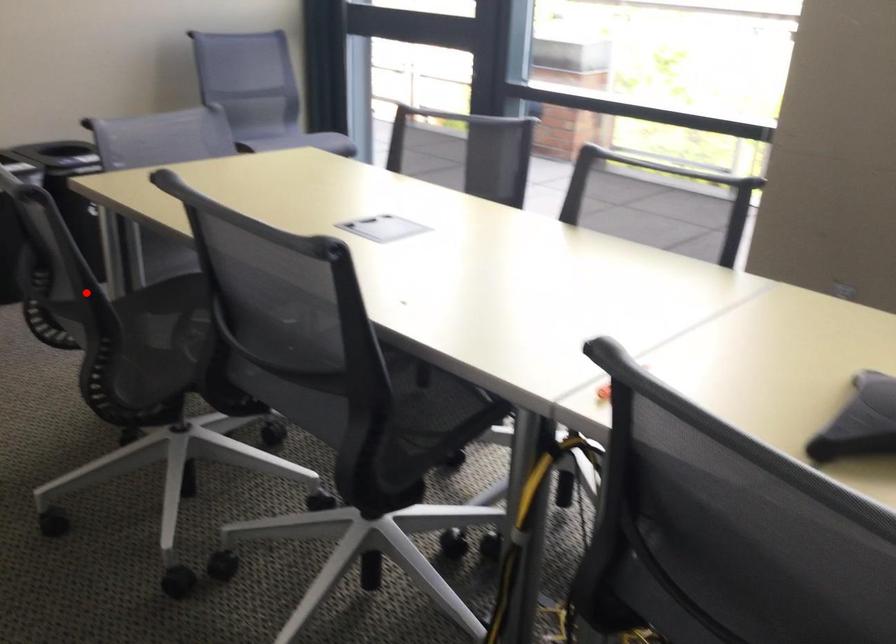
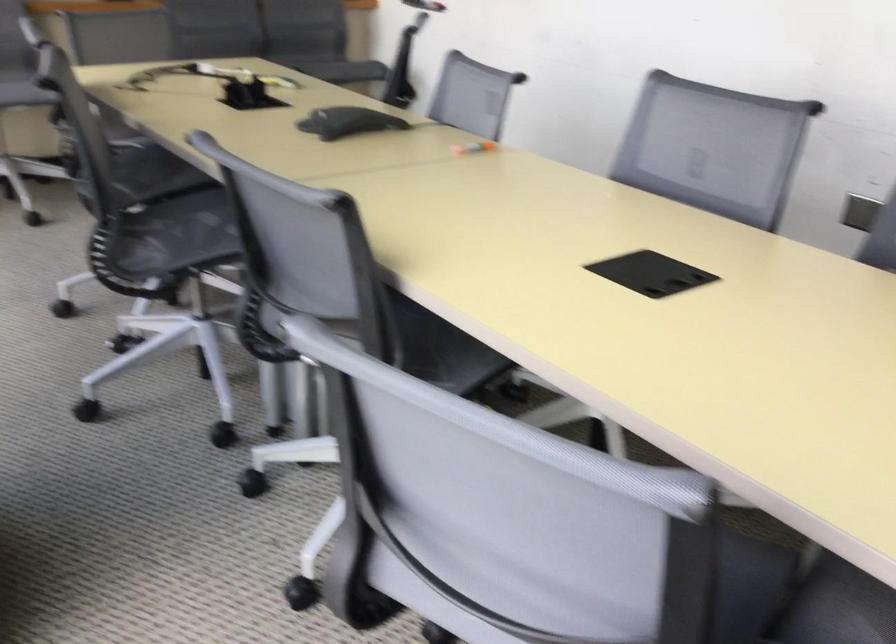
Find the pixel in the second image that matches the highlighted location in the first image.

(879, 241)